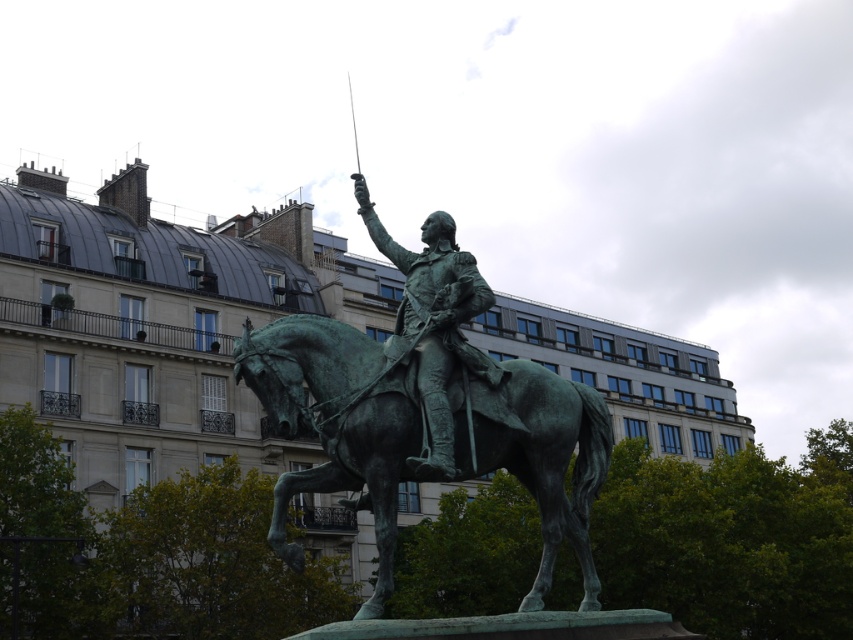
You are an art student analyzing the bronze equestrian statue in the park. You notice two objects labeled as the green patina horse at center and the green patina statue at center. Which object is more to the right?

The green patina horse at center is positioned on the right side of the green patina statue at center, so the horse is more to the right.

You are an art student analyzing the bronze equestrian statue in the public square. You notice the green patina horse at center and the green patina statue at center. Which object is bigger in size?

The green patina horse at center is larger in size compared to the green patina statue at center according to the description.